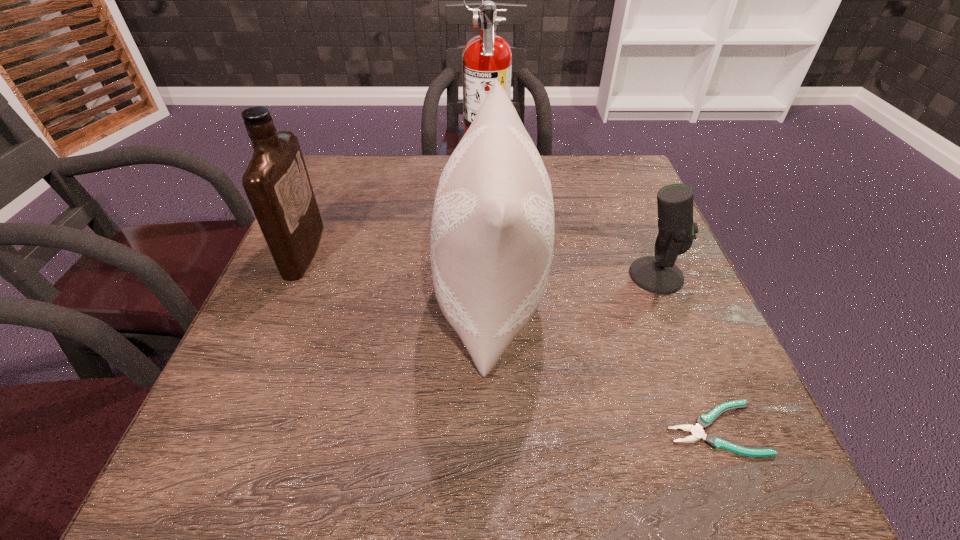
This screenshot has height=540, width=960. Find the location of `vacant space located on the front side of the cushion`. vacant space located on the front side of the cushion is located at coordinates [332, 298].

Identify the location of vacant space located on the front side of the cushion. (292, 298).

At what (x,y) coordinates should I click in order to perform the action: click on vacant region located on the front side of the cushion. Please return your answer as a coordinate pair (x, y). Image resolution: width=960 pixels, height=540 pixels. Looking at the image, I should click on (357, 298).

This screenshot has width=960, height=540. In order to click on vacant space located 0.360m on the label side of the liquor in this screenshot , I will do `click(479, 251)`.

You are a GUI agent. You are given a task and a screenshot of the screen. Output one action in this format:
    pyautogui.click(x=<x>, y=<y>)
    Task: Click on the vacant space located 0.050m on the left of the second shortest object
    This screenshot has height=540, width=960.
    Given the screenshot: What is the action you would take?
    pyautogui.click(x=606, y=275)

Identify the location of blank space located on the back of the nearest object. Image resolution: width=960 pixels, height=540 pixels. (684, 356).

The height and width of the screenshot is (540, 960). In order to click on object at the far edge in this screenshot , I will do `click(487, 57)`.

Locate an element on the screen. The width and height of the screenshot is (960, 540). object located at the near edge is located at coordinates [x=704, y=421].

Find the location of `object present at the left edge`. object present at the left edge is located at coordinates (276, 181).

The height and width of the screenshot is (540, 960). I want to click on microphone present at the right edge, so click(x=658, y=274).